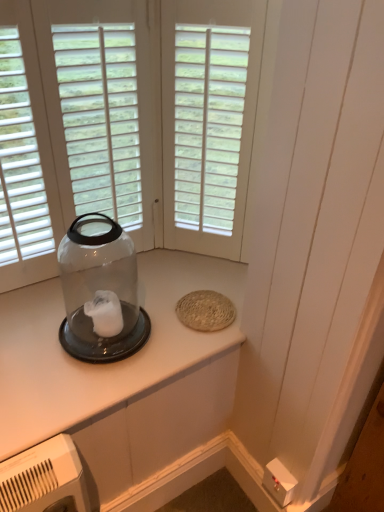
Locate an element on the screen. This screenshot has width=384, height=512. vacant space to the right of transparent glass jar at left is located at coordinates (172, 338).